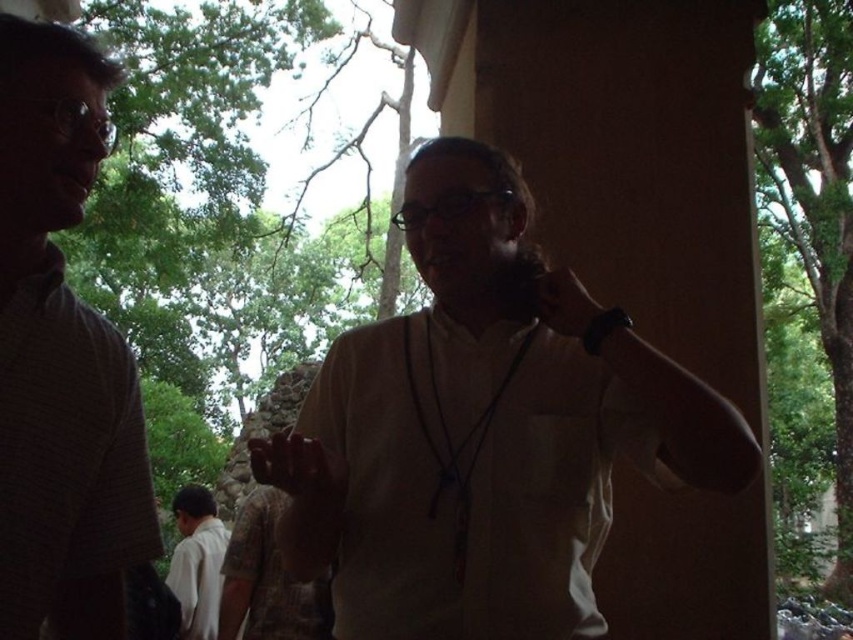
Question: Among these points, which one is nearest to the camera?

Choices:
 (A) (115, 417)
 (B) (544, 264)
 (C) (822, 257)

Answer: (A)

Question: From the image, what is the correct spatial relationship of matte gray shirt at left in relation to white cotton shirt at lower left?

Choices:
 (A) above
 (B) below

Answer: (A)

Question: Is white matte shirt at center wider than green leafy tree at upper left?

Choices:
 (A) no
 (B) yes

Answer: (A)

Question: Among these points, which one is farthest from the camera?

Choices:
 (A) (762, 125)
 (B) (24, 488)

Answer: (A)

Question: Does white matte shirt at center appear on the right side of green leafy tree at upper left?

Choices:
 (A) no
 (B) yes

Answer: (A)

Question: Estimate the real-world distances between objects in this image. Which object is closer to the matte gray shirt at left?

Choices:
 (A) green leafy tree at upper left
 (B) white matte shirt at center
 (C) white cotton shirt at lower left

Answer: (B)